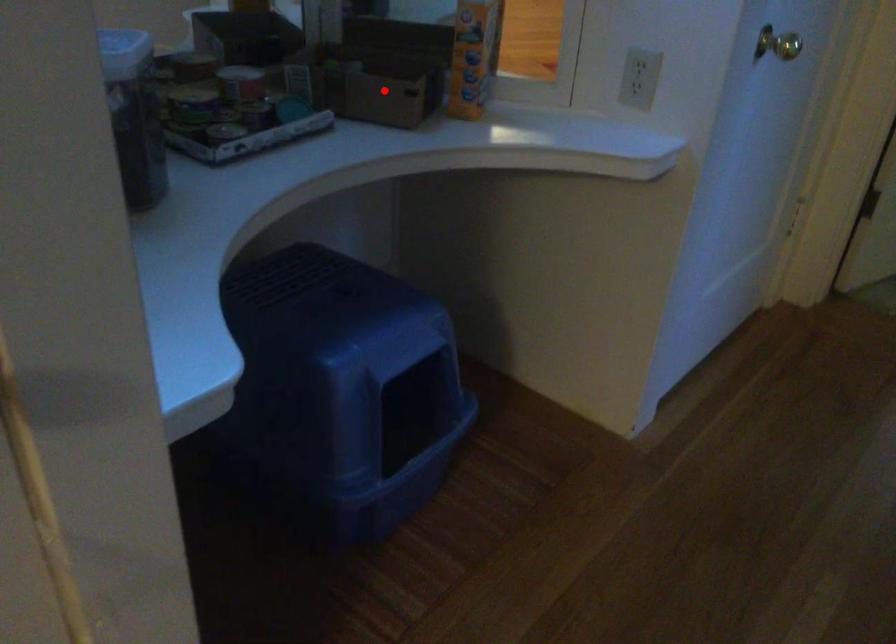
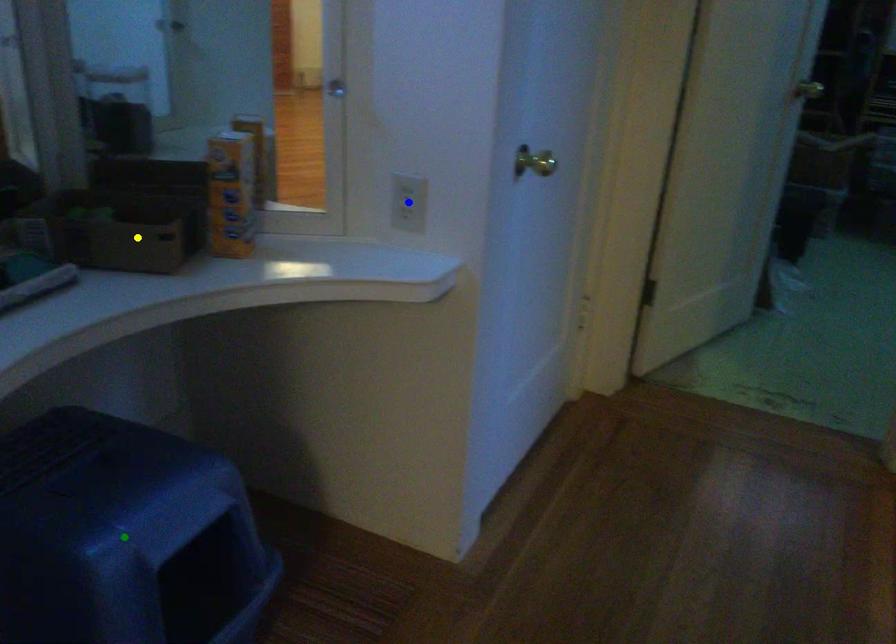
Question: I am providing you with two images of the same scene from different viewpoints. A red point is marked on the first image. You are given multiple points on the second image. Which point in image 2 represents the same 3d spot as the red point in image 1?

Choices:
 (A) yellow point
 (B) green point
 (C) blue point

Answer: (A)